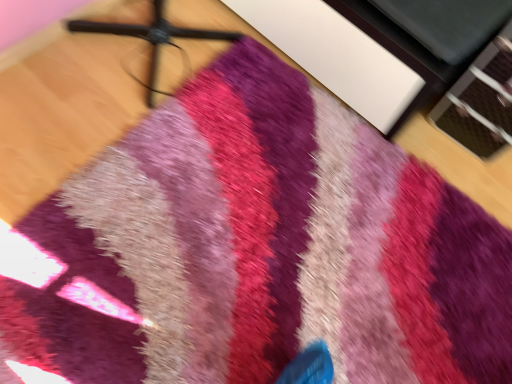
The width and height of the screenshot is (512, 384). What do you see at coordinates (151, 38) in the screenshot?
I see `black plastic tripod at upper center` at bounding box center [151, 38].

This screenshot has width=512, height=384. In order to click on black plastic tripod at upper center in this screenshot , I will do `click(151, 38)`.

Describe the element at coordinates (379, 46) in the screenshot. The image size is (512, 384). I see `white matte cabinet at upper center` at that location.

This screenshot has height=384, width=512. In order to click on white matte cabinet at upper center in this screenshot , I will do `click(379, 46)`.

The height and width of the screenshot is (384, 512). What are the coordinates of `black plastic tripod at upper center` in the screenshot? It's located at (151, 38).

Is white matte cabinet at upper center at the right side of black plastic tripod at upper center?

Correct, you'll find white matte cabinet at upper center to the right of black plastic tripod at upper center.

Is the depth of white matte cabinet at upper center greater than that of black plastic tripod at upper center?

That is True.

Is point (403, 82) closer to camera compared to point (210, 30)?

Yes.

From the image's perspective, which is above, white matte cabinet at upper center or black plastic tripod at upper center?

white matte cabinet at upper center, from the image's perspective.

From a real-world perspective, which object stands above the other?

black plastic tripod at upper center, from a real-world perspective.

Can you confirm if white matte cabinet at upper center is thinner than black plastic tripod at upper center?

No.

Consider the image. Which of these two, white matte cabinet at upper center or black plastic tripod at upper center, stands taller?

Standing taller between the two is black plastic tripod at upper center.

Which of these two, white matte cabinet at upper center or black plastic tripod at upper center, is smaller?

black plastic tripod at upper center is smaller.

Can we say white matte cabinet at upper center lies outside black plastic tripod at upper center?

white matte cabinet at upper center is positioned outside black plastic tripod at upper center.

In the scene shown: Is white matte cabinet at upper center not near black plastic tripod at upper center?

No, white matte cabinet at upper center is not far from black plastic tripod at upper center.

Could you tell me if white matte cabinet at upper center is turned towards black plastic tripod at upper center?

Yes, white matte cabinet at upper center faces towards black plastic tripod at upper center.

How many degrees apart are the facing directions of white matte cabinet at upper center and black plastic tripod at upper center?

white matte cabinet at upper center and black plastic tripod at upper center are facing 90 degrees away from each other.

Where is `tripod lying in front of the white matte cabinet at upper center`? tripod lying in front of the white matte cabinet at upper center is located at coordinates (151, 38).

Based on the photo, which is more to the right, black plastic tripod at upper center or white matte cabinet at upper center?

From the viewer's perspective, white matte cabinet at upper center appears more on the right side.

Is black plastic tripod at upper center closer to the viewer compared to white matte cabinet at upper center?

Yes, black plastic tripod at upper center is closer to the camera.

Which is closer, (234, 33) or (345, 31)?

Point (234, 33) is positioned farther from the camera compared to point (345, 31).

From the image's perspective, which one is positioned lower, black plastic tripod at upper center or white matte cabinet at upper center?

black plastic tripod at upper center appears lower in the image.

From the picture: From a real-world perspective, who is located lower, black plastic tripod at upper center or white matte cabinet at upper center?

white matte cabinet at upper center is physically lower.

Between black plastic tripod at upper center and white matte cabinet at upper center, which one has smaller width?

With smaller width is black plastic tripod at upper center.

Is black plastic tripod at upper center taller than white matte cabinet at upper center?

Yes, black plastic tripod at upper center is taller than white matte cabinet at upper center.

Which of these two, black plastic tripod at upper center or white matte cabinet at upper center, is bigger?

white matte cabinet at upper center is bigger.

Is black plastic tripod at upper center outside of white matte cabinet at upper center?

Yes, black plastic tripod at upper center is located beyond the bounds of white matte cabinet at upper center.

Are black plastic tripod at upper center and white matte cabinet at upper center beside each other?

black plastic tripod at upper center and white matte cabinet at upper center are not in contact.

Is black plastic tripod at upper center looking in the opposite direction of white matte cabinet at upper center?

No, black plastic tripod at upper center is not facing away from white matte cabinet at upper center.

Can you tell me how much black plastic tripod at upper center and white matte cabinet at upper center differ in facing direction?

There is a 90-degree angle between the facing directions of black plastic tripod at upper center and white matte cabinet at upper center.

Measure the distance from black plastic tripod at upper center to white matte cabinet at upper center.

A distance of 17.85 inches exists between black plastic tripod at upper center and white matte cabinet at upper center.

At what (x,y) coordinates should I click in order to perform the action: click on furniture that appears above the black plastic tripod at upper center (from the image's perspective). Please return your answer as a coordinate pair (x, y). Image resolution: width=512 pixels, height=384 pixels. Looking at the image, I should click on (379, 46).

The height and width of the screenshot is (384, 512). I want to click on furniture above the black plastic tripod at upper center (from the image's perspective), so click(x=379, y=46).

Identify the location of tripod lying on the left of white matte cabinet at upper center. The image size is (512, 384). (151, 38).